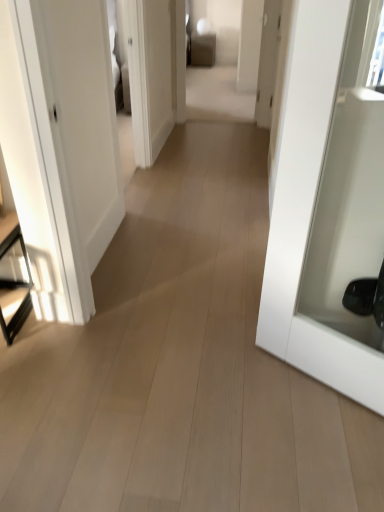
Question: Considering the positions of black glass table at left and white glossy door at right in the image, is black glass table at left wider or thinner than white glossy door at right?

Choices:
 (A) thin
 (B) wide

Answer: (B)

Question: Is point (24, 263) closer or farther from the camera than point (294, 102)?

Choices:
 (A) closer
 (B) farther

Answer: (B)

Question: From a real-world perspective, is black glass table at left above or below white glossy door at right?

Choices:
 (A) below
 (B) above

Answer: (A)

Question: Looking at the image, does white glossy door at right seem bigger or smaller compared to black glass table at left?

Choices:
 (A) small
 (B) big

Answer: (B)

Question: From the image's perspective, is white glossy door at right positioned above or below black glass table at left?

Choices:
 (A) below
 (B) above

Answer: (B)

Question: From a real-world perspective, is white glossy door at right above or below black glass table at left?

Choices:
 (A) above
 (B) below

Answer: (A)

Question: Considering the positions of white glossy door at right and black glass table at left in the image, is white glossy door at right wider or thinner than black glass table at left?

Choices:
 (A) wide
 (B) thin

Answer: (B)